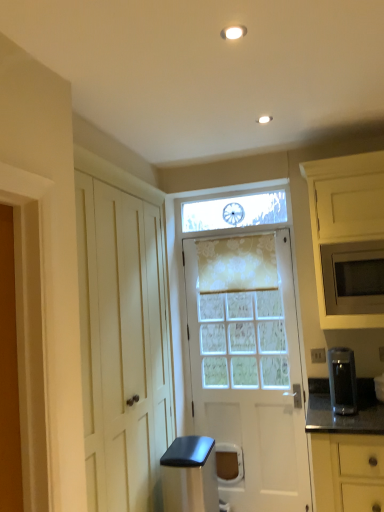
At what (x,y) coordinates should I click in order to perform the action: click on free space above floral sheer curtain at center (from a real-world perspective). Please return your answer as a coordinate pair (x, y). The width and height of the screenshot is (384, 512). Looking at the image, I should click on (227, 229).